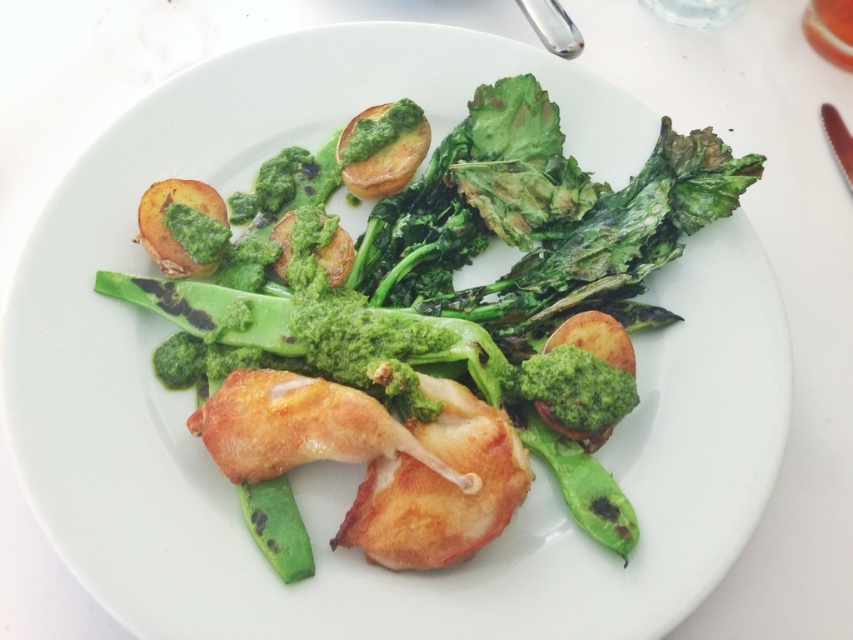
Which is behind, point (538, 404) or point (149, 211)?

Positioned behind is point (149, 211).

Is green smooth broccoli at center closer to the viewer compared to matte golden-brown potato at upper left?

Yes, green smooth broccoli at center is in front of matte golden-brown potato at upper left.

Where is `green smooth broccoli at center`? The height and width of the screenshot is (640, 853). green smooth broccoli at center is located at coordinates (575, 390).

The height and width of the screenshot is (640, 853). Find the location of `green smooth broccoli at center`. green smooth broccoli at center is located at coordinates (575, 390).